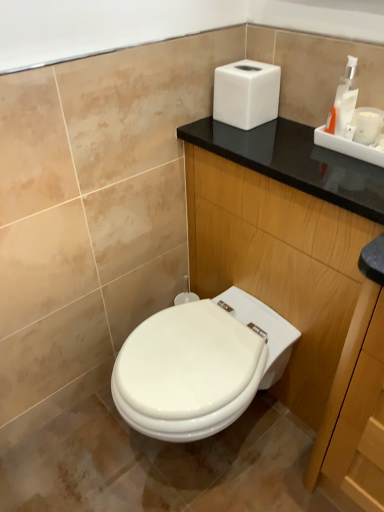
Question: Considering the relative positions of white plastic soap dispenser at upper right and white matte hand dryer at upper right in the image provided, is white plastic soap dispenser at upper right to the right of white matte hand dryer at upper right from the viewer's perspective?

Choices:
 (A) yes
 (B) no

Answer: (A)

Question: Is white plastic soap dispenser at upper right positioned with its back to white matte hand dryer at upper right?

Choices:
 (A) yes
 (B) no

Answer: (B)

Question: Is white plastic soap dispenser at upper right facing towards white matte hand dryer at upper right?

Choices:
 (A) yes
 (B) no

Answer: (B)

Question: Is white plastic soap dispenser at upper right at the left side of white matte hand dryer at upper right?

Choices:
 (A) yes
 (B) no

Answer: (B)

Question: Considering the relative sizes of white plastic soap dispenser at upper right and white matte hand dryer at upper right in the image provided, is white plastic soap dispenser at upper right taller than white matte hand dryer at upper right?

Choices:
 (A) no
 (B) yes

Answer: (B)

Question: From a real-world perspective, is white plastic soap dispenser at upper right physically above white matte hand dryer at upper right?

Choices:
 (A) yes
 (B) no

Answer: (A)

Question: Could white matte hand dryer at upper right be considered to be inside black wood dresser at upper right?

Choices:
 (A) yes
 (B) no

Answer: (B)

Question: Can you confirm if black wood dresser at upper right is smaller than white matte hand dryer at upper right?

Choices:
 (A) yes
 (B) no

Answer: (B)

Question: Is black wood dresser at upper right further to the viewer compared to white matte hand dryer at upper right?

Choices:
 (A) yes
 (B) no

Answer: (B)

Question: Considering the relative sizes of black wood dresser at upper right and white matte hand dryer at upper right in the image provided, is black wood dresser at upper right shorter than white matte hand dryer at upper right?

Choices:
 (A) yes
 (B) no

Answer: (B)

Question: From the image's perspective, is black wood dresser at upper right below white matte hand dryer at upper right?

Choices:
 (A) no
 (B) yes

Answer: (B)

Question: From a real-world perspective, is black wood dresser at upper right positioned under white matte hand dryer at upper right based on gravity?

Choices:
 (A) yes
 (B) no

Answer: (A)

Question: Is black wood dresser at upper right looking in the opposite direction of white plastic soap dispenser at upper right?

Choices:
 (A) no
 (B) yes

Answer: (A)